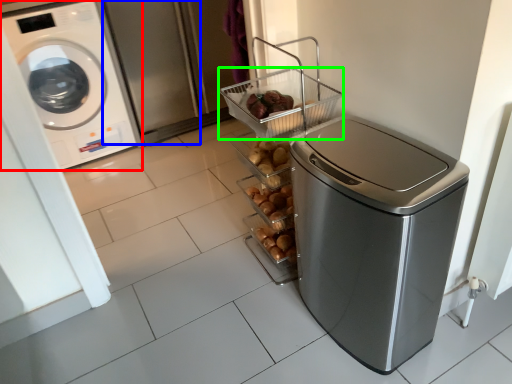
Question: Which object is positioned closest to washing machine (highlighted by a red box)? Select from screen door (highlighted by a blue box) and basket (highlighted by a green box).

Choices:
 (A) screen door
 (B) basket

Answer: (A)